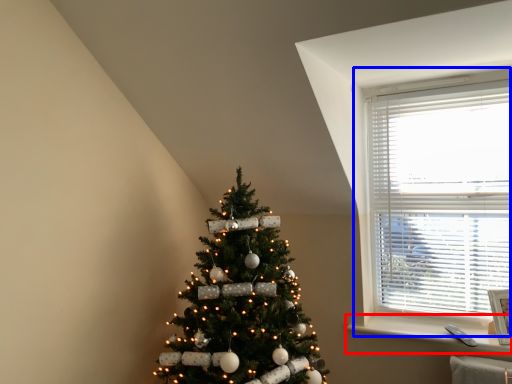
Question: Among these objects, which one is nearest to the camera, window sill (highlighted by a red box) or window (highlighted by a blue box)?

Choices:
 (A) window sill
 (B) window

Answer: (A)